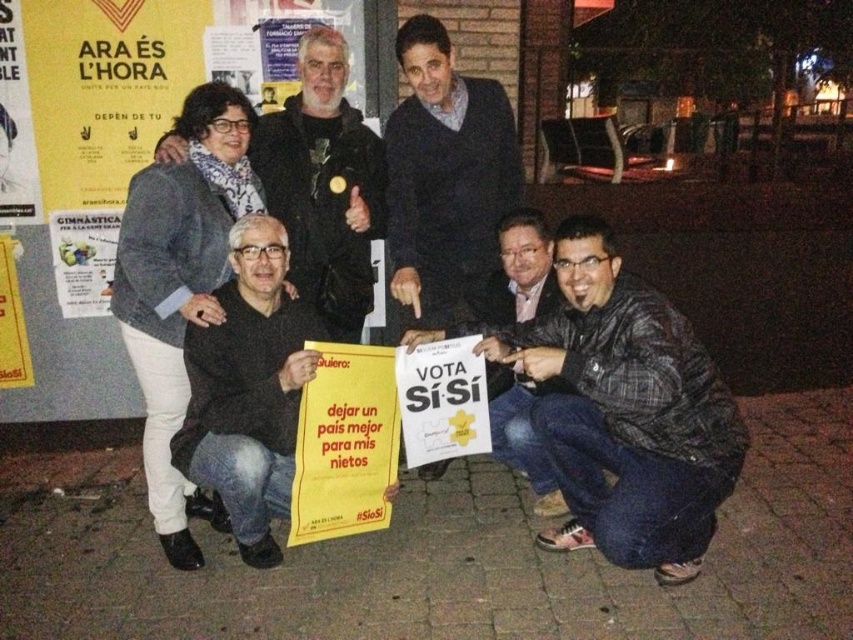
Question: Can you confirm if yellow paper poster at upper left is bigger than dark blue sweater at center?

Choices:
 (A) yes
 (B) no

Answer: (A)

Question: Which point is farther from the camera taking this photo?

Choices:
 (A) (79, 493)
 (B) (509, 157)
 (C) (527, 241)

Answer: (A)

Question: Does black matte sign at lower left have a smaller size compared to white paper sign at lower center?

Choices:
 (A) yes
 (B) no

Answer: (A)

Question: Which of these objects is positioned farthest from the brick pavement at lower center?

Choices:
 (A) matte black jacket at upper left
 (B) white paper sign at lower center
 (C) leather jacket at lower right
 (D) yellow paper poster at upper left

Answer: (D)

Question: Does leather jacket at lower right appear under dark blue sweater at center?

Choices:
 (A) yes
 (B) no

Answer: (A)

Question: Considering the real-world distances, which object is closest to the white paper sign at lower center?

Choices:
 (A) leather jacket at lower right
 (B) dark blue sweater at center
 (C) brick pavement at lower center

Answer: (A)